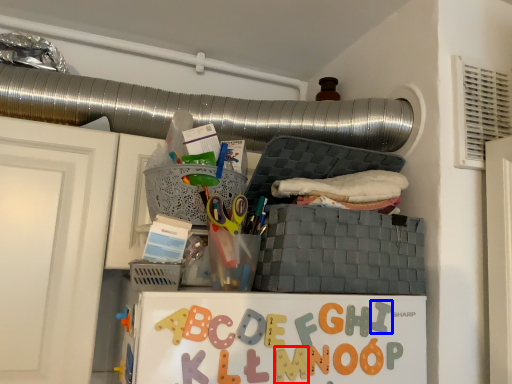
Question: Among these objects, which one is nearest to the camera, alphabet (highlighted by a red box) or alphabet (highlighted by a blue box)?

Choices:
 (A) alphabet
 (B) alphabet

Answer: (A)